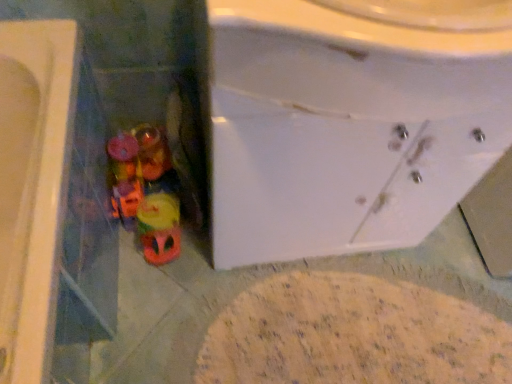
Describe the element at coordinates (144, 191) in the screenshot. The image size is (512, 384). I see `rubberized plastic toys at lower left` at that location.

Locate an element on the screen. The height and width of the screenshot is (384, 512). rubberized plastic toys at lower left is located at coordinates (144, 191).

Locate an element on the screen. white glossy sink at center is located at coordinates click(345, 128).

Image resolution: width=512 pixels, height=384 pixels. Describe the element at coordinates (345, 128) in the screenshot. I see `white glossy sink at center` at that location.

Image resolution: width=512 pixels, height=384 pixels. What are the coordinates of `rubberized plastic toys at lower left` in the screenshot? It's located at (144, 191).

Is rubberized plastic toys at lower left to the left or to the right of white glossy sink at center in the image?

In the image, rubberized plastic toys at lower left appears on the left side of white glossy sink at center.

Who is more distant, rubberized plastic toys at lower left or white glossy sink at center?

rubberized plastic toys at lower left is further away from the camera.

Considering the points (148, 239) and (460, 89), which point is behind, point (148, 239) or point (460, 89)?

The point (148, 239) is more distant.

From the image's perspective, relative to white glossy sink at center, is rubberized plastic toys at lower left above or below?

rubberized plastic toys at lower left is below white glossy sink at center.

From a real-world perspective, does rubberized plastic toys at lower left stand above white glossy sink at center?

Incorrect, from a real-world perspective, rubberized plastic toys at lower left is lower than white glossy sink at center.

Is rubberized plastic toys at lower left thinner than white glossy sink at center?

Yes.

Is rubberized plastic toys at lower left taller or shorter than white glossy sink at center?

In the image, rubberized plastic toys at lower left appears to be shorter than white glossy sink at center.

Based on their sizes in the image, would you say rubberized plastic toys at lower left is bigger or smaller than white glossy sink at center?

Considering their sizes, rubberized plastic toys at lower left takes up less space than white glossy sink at center.

Do you think rubberized plastic toys at lower left is within white glossy sink at center, or outside of it?

rubberized plastic toys at lower left is spatially situated outside white glossy sink at center.

Is rubberized plastic toys at lower left next to white glossy sink at center?

No, rubberized plastic toys at lower left is not touching white glossy sink at center.

Could you tell me if rubberized plastic toys at lower left is turned towards white glossy sink at center?

No, rubberized plastic toys at lower left is not facing towards white glossy sink at center.

Can you tell me how much rubberized plastic toys at lower left and white glossy sink at center differ in facing direction?

1.73 degrees separate the facing orientations of rubberized plastic toys at lower left and white glossy sink at center.

At what (x,y) coordinates should I click in order to perform the action: click on sink above the rubberized plastic toys at lower left (from the image's perspective). Please return your answer as a coordinate pair (x, y). The height and width of the screenshot is (384, 512). Looking at the image, I should click on (345, 128).

Does white glossy sink at center appear on the left side of rubberized plastic toys at lower left?

No.

In the scene shown: Does white glossy sink at center come in front of rubberized plastic toys at lower left?

Yes, white glossy sink at center is in front of rubberized plastic toys at lower left.

Is point (457, 170) closer or farther from the camera than point (109, 145)?

Point (457, 170).

From the image's perspective, which one is positioned lower, white glossy sink at center or rubberized plastic toys at lower left?

rubberized plastic toys at lower left.

From a real-world perspective, is white glossy sink at center positioned over rubberized plastic toys at lower left based on gravity?

Yes, from a real-world perspective, white glossy sink at center is above rubberized plastic toys at lower left.

Can you confirm if white glossy sink at center is thinner than rubberized plastic toys at lower left?

No.

Which of these two, white glossy sink at center or rubberized plastic toys at lower left, stands shorter?

With less height is rubberized plastic toys at lower left.

Who is smaller, white glossy sink at center or rubberized plastic toys at lower left?

rubberized plastic toys at lower left.

Would you say white glossy sink at center is outside rubberized plastic toys at lower left?

Absolutely, white glossy sink at center is external to rubberized plastic toys at lower left.

Is white glossy sink at center beside rubberized plastic toys at lower left?

No.

Is white glossy sink at center facing towards rubberized plastic toys at lower left?

No, white glossy sink at center is not aimed at rubberized plastic toys at lower left.

What's the angular difference between white glossy sink at center and rubberized plastic toys at lower left's facing directions?

There is a 1.73-degree angle between the facing directions of white glossy sink at center and rubberized plastic toys at lower left.

Where is `toy to the left of white glossy sink at center`? toy to the left of white glossy sink at center is located at coordinates (144, 191).

Find the location of `toy that appears below the white glossy sink at center (from the image's perspective)`. toy that appears below the white glossy sink at center (from the image's perspective) is located at coordinates (144, 191).

This screenshot has width=512, height=384. What are the coordinates of `toy behind the white glossy sink at center` in the screenshot? It's located at (144, 191).